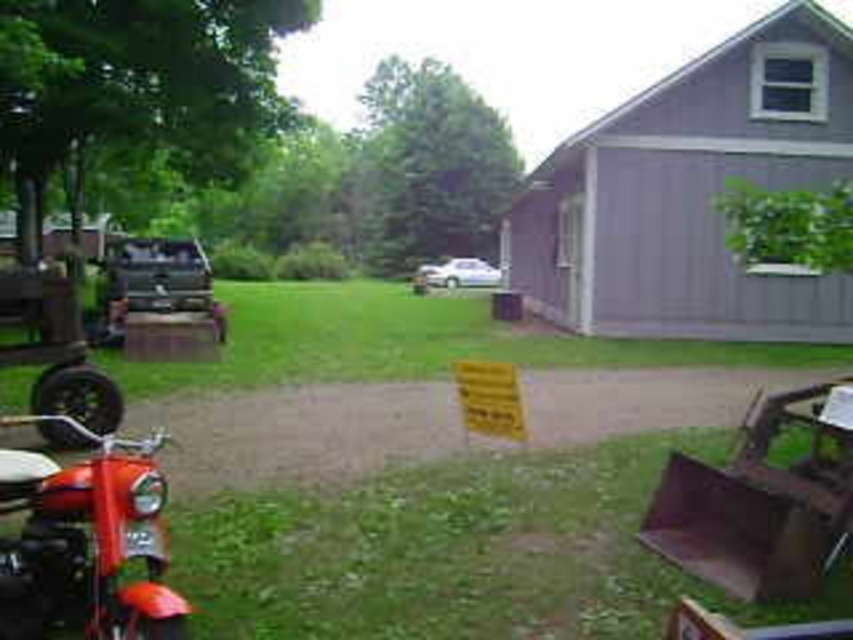
You are planning to park your car on the smooth concrete driveway at center but need to check if there is enough space. There is a purple woodshed at upper right nearby. Which direction should you avoid when parking to ensure you don not hit the woodshed?

The purple woodshed at upper right is to the right of the smooth concrete driveway at center. Therefore, you should avoid parking too far to the right side of the smooth concrete driveway at center to prevent hitting the purple woodshed at upper right.